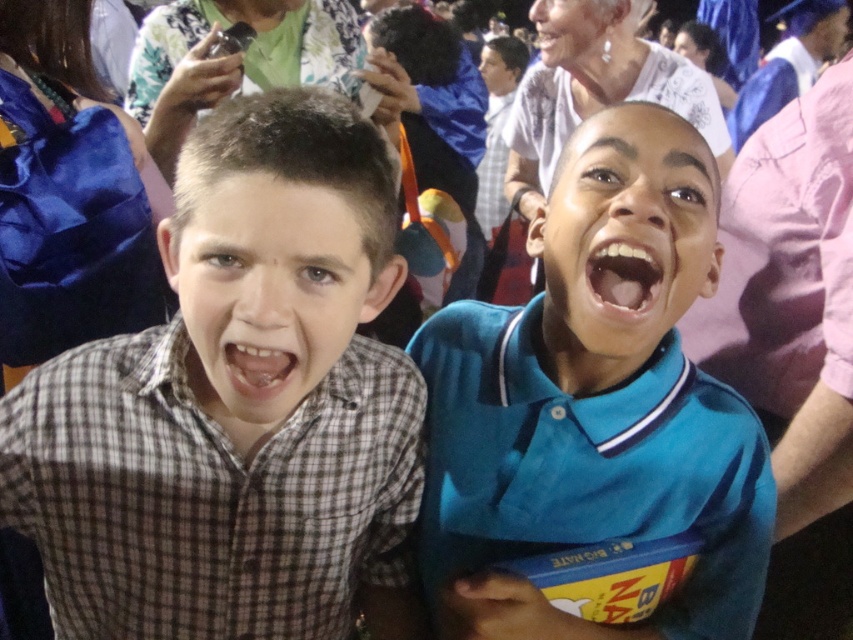
Can you confirm if brown checkered shirt at left is shorter than blue matte shirt at center?

No, brown checkered shirt at left is not shorter than blue matte shirt at center.

Does point (184, 406) come in front of point (700, 248)?

Yes.

This screenshot has width=853, height=640. What are the coordinates of `brown checkered shirt at left` in the screenshot? It's located at (235, 403).

Can you confirm if teal polo shirt at center is positioned above checkered fabric face at center?

Actually, teal polo shirt at center is below checkered fabric face at center.

In the scene shown: Who is shorter, teal polo shirt at center or checkered fabric face at center?

With less height is checkered fabric face at center.

Who is more distant from viewer, (622,515) or (347,244)?

Positioned behind is point (622,515).

You are a GUI agent. You are given a task and a screenshot of the screen. Output one action in this format:
    pyautogui.click(x=<x>, y=<y>)
    Task: Click on the teal polo shirt at center
    The width and height of the screenshot is (853, 640).
    Given the screenshot: What is the action you would take?
    pyautogui.click(x=595, y=401)

Can you confirm if teal polo shirt at center is shorter than matte white face at upper center?

No, teal polo shirt at center is not shorter than matte white face at upper center.

Does point (682, 486) lie behind point (567, 42)?

No, (682, 486) is in front of (567, 42).

Is point (618, 132) positioned before point (590, 28)?

Yes, point (618, 132) is in front of point (590, 28).

The width and height of the screenshot is (853, 640). Identify the location of teal polo shirt at center. (595, 401).